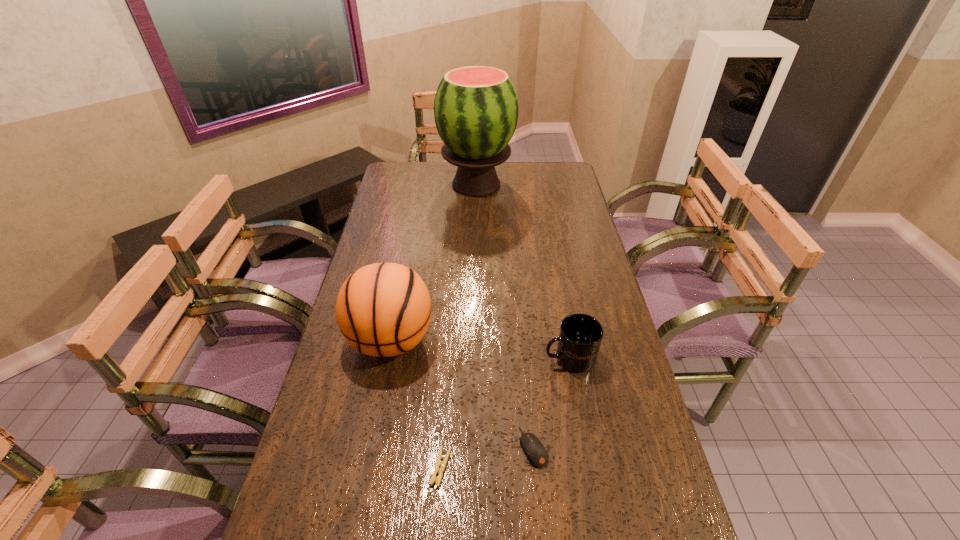
The width and height of the screenshot is (960, 540). I want to click on the tallest object, so click(x=476, y=108).

Find the location of a particular element. Image resolution: width=960 pixels, height=540 pixels. the farthest object is located at coordinates (476, 108).

This screenshot has height=540, width=960. Identify the location of basketball. (383, 309).

What are the coordinates of `the rightmost object` in the screenshot? It's located at (580, 335).

In order to click on the third shortest object in this screenshot , I will do `click(580, 335)`.

I want to click on computer mouse, so click(535, 452).

I want to click on clothespin, so click(x=437, y=470).

Image resolution: width=960 pixels, height=540 pixels. Identify the location of vacant space situated on the front of the farthest object. (476, 226).

The width and height of the screenshot is (960, 540). Identify the location of vacant space situated 0.120m on the back of the second tallest object. (402, 282).

Where is `free space located with the handle on the side of the third tallest object`? This screenshot has width=960, height=540. free space located with the handle on the side of the third tallest object is located at coordinates (511, 357).